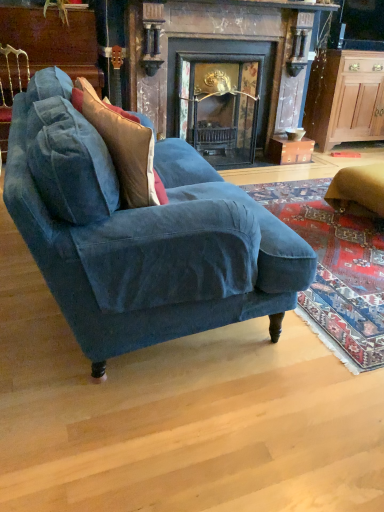
Question: Considering the relative positions of velvet cushion at left and wooden cabinet at right in the image provided, is velvet cushion at left in front of wooden cabinet at right?

Choices:
 (A) no
 (B) yes

Answer: (B)

Question: Does velvet cushion at left have a smaller size compared to wooden cabinet at right?

Choices:
 (A) no
 (B) yes

Answer: (B)

Question: Considering the relative sizes of velvet cushion at left and wooden cabinet at right in the image provided, is velvet cushion at left wider than wooden cabinet at right?

Choices:
 (A) no
 (B) yes

Answer: (A)

Question: Considering the relative sizes of velvet cushion at left and wooden cabinet at right in the image provided, is velvet cushion at left bigger than wooden cabinet at right?

Choices:
 (A) no
 (B) yes

Answer: (A)

Question: Is velvet cushion at left further to camera compared to wooden cabinet at right?

Choices:
 (A) no
 (B) yes

Answer: (A)

Question: Looking at their shapes, would you say wooden cabinet at right is wider or thinner than dark wood fireplace at center?

Choices:
 (A) thin
 (B) wide

Answer: (A)

Question: Is wooden cabinet at right bigger or smaller than dark wood fireplace at center?

Choices:
 (A) small
 (B) big

Answer: (A)

Question: Is wooden cabinet at right taller or shorter than dark wood fireplace at center?

Choices:
 (A) short
 (B) tall

Answer: (A)

Question: Is wooden cabinet at right in front of or behind dark wood fireplace at center in the image?

Choices:
 (A) front
 (B) behind

Answer: (B)

Question: Is velvet blue couch at center situated inside velvet blue armchair at upper left or outside?

Choices:
 (A) inside
 (B) outside

Answer: (B)

Question: Does point (64, 230) appear closer or farther from the camera than point (0, 142)?

Choices:
 (A) closer
 (B) farther

Answer: (A)

Question: Based on their sizes in the image, would you say velvet blue couch at center is bigger or smaller than velvet blue armchair at upper left?

Choices:
 (A) big
 (B) small

Answer: (A)

Question: In terms of width, does velvet blue couch at center look wider or thinner when compared to velvet blue armchair at upper left?

Choices:
 (A) thin
 (B) wide

Answer: (B)

Question: Considering the positions of point (261, 287) and point (342, 122), is point (261, 287) closer or farther from the camera than point (342, 122)?

Choices:
 (A) farther
 (B) closer

Answer: (B)

Question: In the image, is velvet blue couch at center positioned in front of or behind wooden cabinet at right?

Choices:
 (A) behind
 (B) front

Answer: (B)